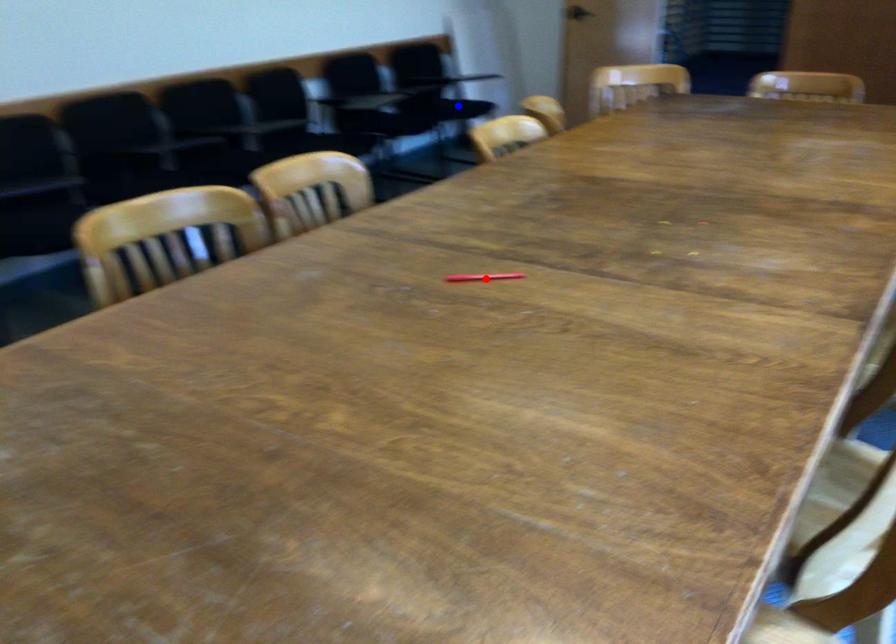
Question: In the image, two points are highlighted. Which point is nearer to the camera? Reply with the corresponding letter.

Choices:
 (A) blue point
 (B) red point

Answer: (B)